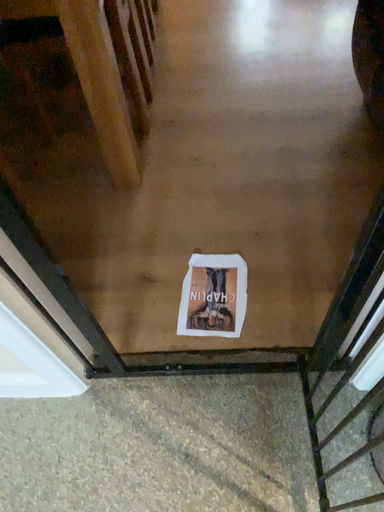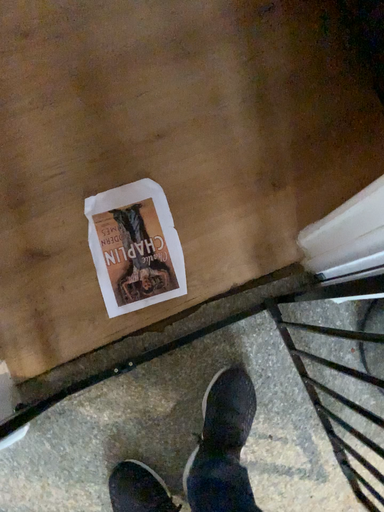
Question: Which way did the camera rotate in the video?

Choices:
 (A) rotated downward
 (B) rotated upward

Answer: (A)